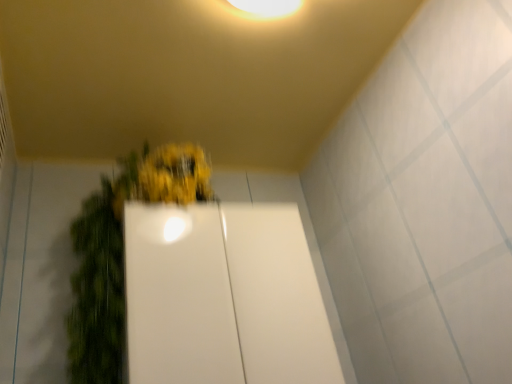
Question: Are green matte plant at center and white glossy door at center located far from each other?

Choices:
 (A) no
 (B) yes

Answer: (A)

Question: Is green matte plant at center oriented away from white glossy door at center?

Choices:
 (A) yes
 (B) no

Answer: (A)

Question: Is green matte plant at center thinner than white glossy door at center?

Choices:
 (A) yes
 (B) no

Answer: (B)

Question: From the image's perspective, is green matte plant at center beneath white glossy door at center?

Choices:
 (A) yes
 (B) no

Answer: (B)

Question: Is green matte plant at center oriented towards white glossy door at center?

Choices:
 (A) no
 (B) yes

Answer: (B)

Question: Can you confirm if green matte plant at center is taller than white glossy door at center?

Choices:
 (A) yes
 (B) no

Answer: (A)

Question: Is white glossy door at center turned away from green matte plant at center?

Choices:
 (A) yes
 (B) no

Answer: (A)

Question: Is white glossy door at center shorter than green matte plant at center?

Choices:
 (A) yes
 (B) no

Answer: (A)

Question: Is white glossy door at center to the left of green matte plant at center from the viewer's perspective?

Choices:
 (A) yes
 (B) no

Answer: (B)

Question: From the image's perspective, is white glossy door at center on green matte plant at center?

Choices:
 (A) no
 (B) yes

Answer: (A)

Question: Is white glossy door at center at the right side of green matte plant at center?

Choices:
 (A) yes
 (B) no

Answer: (A)

Question: Considering the relative sizes of white glossy door at center and green matte plant at center in the image provided, is white glossy door at center taller than green matte plant at center?

Choices:
 (A) yes
 (B) no

Answer: (B)

Question: Looking at the image, does white glossy door at center seem bigger or smaller compared to green matte plant at center?

Choices:
 (A) small
 (B) big

Answer: (A)